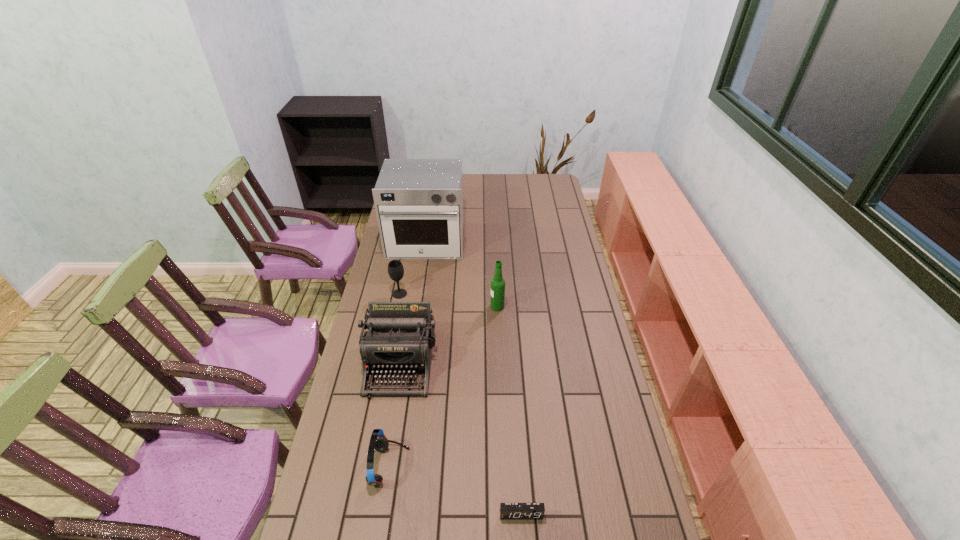
Locate an element on the screen. Image resolution: width=960 pixels, height=540 pixels. the nearest object is located at coordinates (507, 510).

Where is `the shortest object`? The height and width of the screenshot is (540, 960). the shortest object is located at coordinates pos(507,510).

Find the location of a particular element. vacant region located on the front panel of the farthest object is located at coordinates (418, 297).

The image size is (960, 540). Find the location of `vacant region located on the label of the second tallest object`. vacant region located on the label of the second tallest object is located at coordinates (466, 307).

You are a GUI agent. You are given a task and a screenshot of the screen. Output one action in this format:
    pyautogui.click(x=<x>, y=<y>)
    Task: Click on the vacant space located 0.110m on the label of the second tallest object
    
    Given the screenshot: What is the action you would take?
    pyautogui.click(x=464, y=307)

Where is `vacant space positioned on the label of the second tallest object`? The height and width of the screenshot is (540, 960). vacant space positioned on the label of the second tallest object is located at coordinates (402, 307).

Identify the location of vacant point located 0.210m on the keyboard of the fourth farthest object. (383, 461).

Where is `vacant space located 0.350m on the right of the fifth nearest object`? The height and width of the screenshot is (540, 960). vacant space located 0.350m on the right of the fifth nearest object is located at coordinates (491, 294).

Find the location of a particular element. The height and width of the screenshot is (540, 960). free region located with the microphone attached to the side of the fifth tallest object is located at coordinates (442, 467).

Find the location of `toaster oven present at the left edge`. toaster oven present at the left edge is located at coordinates (419, 202).